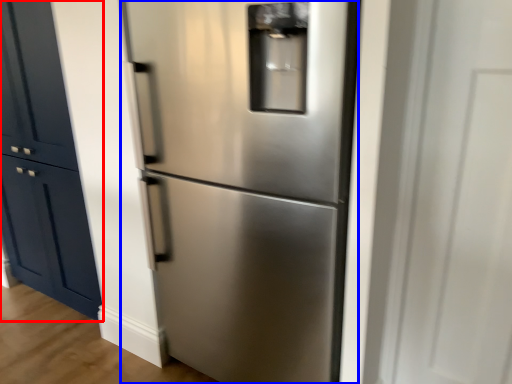
Question: Among these objects, which one is nearest to the camera, door (highlighted by a red box) or refrigerator (highlighted by a blue box)?

Choices:
 (A) door
 (B) refrigerator

Answer: (B)